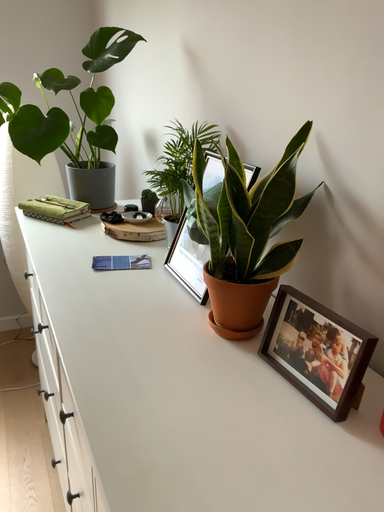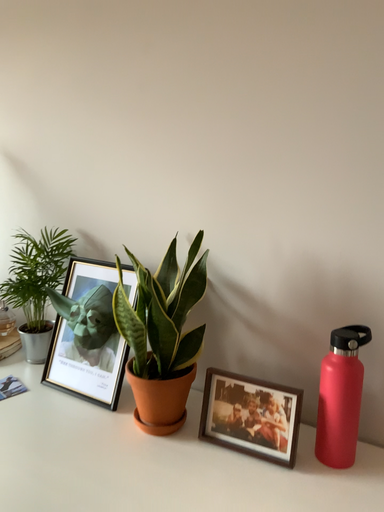
Question: Which way did the camera rotate in the video?

Choices:
 (A) rotated left
 (B) rotated right

Answer: (B)